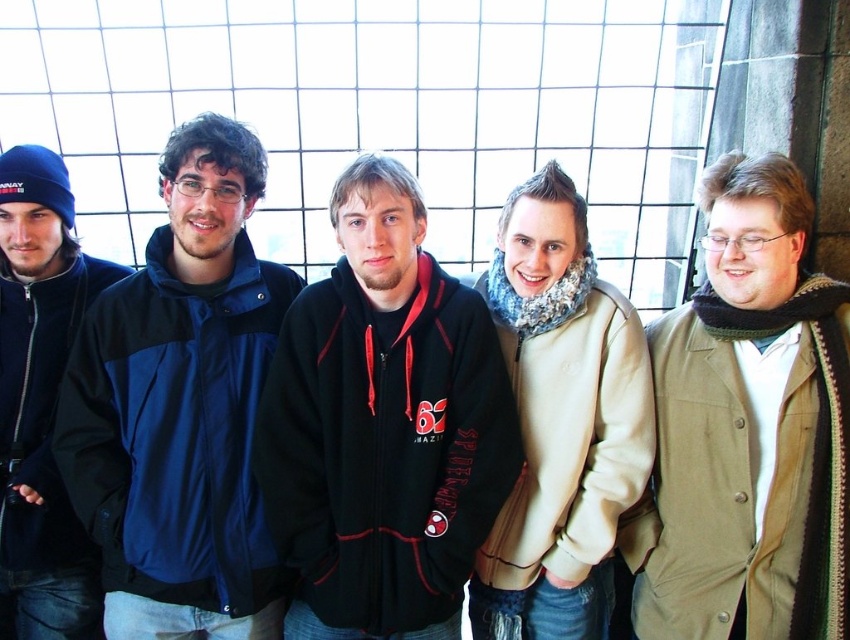
You are a photographer trying to capture a clear shot of the black fleece sweatshirt at center and the dark blue fleece jacket at left. Since you want both to be visible, would adjusting your camera angle help ensure both are in focus?

The black fleece sweatshirt at center is in front of the dark blue fleece jacket at left, so adjusting your camera angle to position yourself where both are not obscured could help ensure both are visible and in focus.

You are standing in front of the group of people in the image. You want to hand a gift to the person wearing the black fleece sweatshirt at center without disturbing the person in the dark blue fleece jacket at left. How can you approach them?

Since the black fleece sweatshirt at center is positioned under the dark blue fleece jacket at left, you should approach from the right side of the dark blue fleece jacket at left to reach the black fleece sweatshirt at center without blocking their view or moving too close to the dark blue fleece jacket at left.

Based on the scene description, where is the blue fabric jacket at center located in terms of its 2D coordinates?

The blue fabric jacket at center is located at the 2D coordinates of point (180, 406).